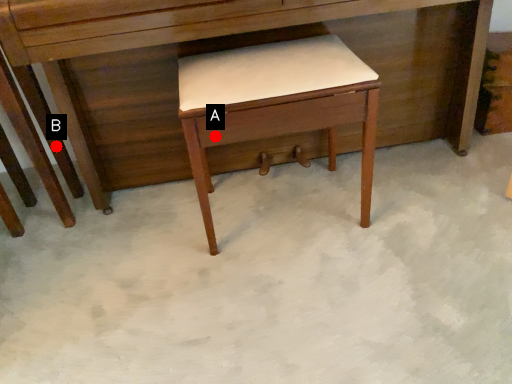
Question: Two points are circled on the image, labeled by A and B beside each circle. Which point is closer to the camera taking this photo?

Choices:
 (A) A is closer
 (B) B is closer

Answer: (A)